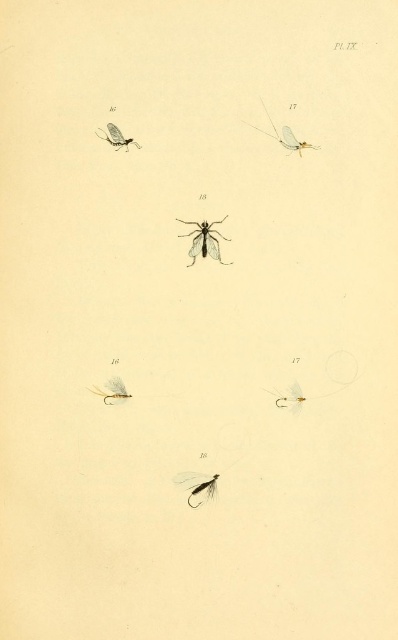
Question: Which point appears closest to the camera in this image?

Choices:
 (A) (271, 124)
 (B) (117, 141)

Answer: (A)

Question: Can you confirm if transparent plastic mosquito at center is smaller than matte black fly at center?

Choices:
 (A) no
 (B) yes

Answer: (A)

Question: From the image, what is the correct spatial relationship of matte black fly at center in relation to translucent white insect at upper center?

Choices:
 (A) right
 (B) left

Answer: (B)

Question: Can you confirm if matte gold hook at lower right is smaller than matte black insect at upper left?

Choices:
 (A) yes
 (B) no

Answer: (A)

Question: Considering the real-world distances, which object is farthest from the matte black fly at center?

Choices:
 (A) transparent plastic mosquito at center
 (B) matte gold hook at lower right
 (C) matte black insect at upper left

Answer: (C)

Question: Which object is farther from the camera taking this photo?

Choices:
 (A) transparent plastic mosquito at center
 (B) matte gold hook at lower right

Answer: (B)